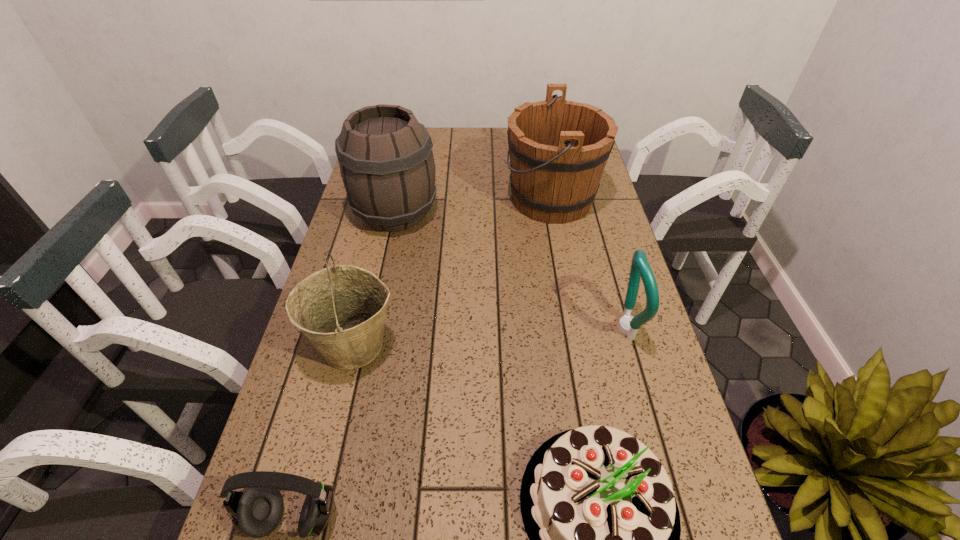
The image size is (960, 540). I want to click on the rightmost wine bucket, so click(x=558, y=149).

Locate an element on the screen. This screenshot has height=540, width=960. the nearest wine bucket is located at coordinates (341, 309).

Locate an element on the screen. the third shortest object is located at coordinates (x=628, y=325).

The image size is (960, 540). In order to click on free space located 0.350m on the side of the rightmost wine bucket with the handle for carrying in this screenshot , I will do `click(396, 199)`.

Where is `blank space located on the side of the rightmost wine bucket with the handle for carrying`? blank space located on the side of the rightmost wine bucket with the handle for carrying is located at coordinates (480, 199).

Where is `free spot located 0.320m on the side of the rightmost wine bucket with the handle for carrying`? The height and width of the screenshot is (540, 960). free spot located 0.320m on the side of the rightmost wine bucket with the handle for carrying is located at coordinates (406, 199).

Find the location of `vacant region located on the back of the nearest wine bucket`. vacant region located on the back of the nearest wine bucket is located at coordinates (382, 229).

You are a GUI agent. You are given a task and a screenshot of the screen. Output one action in this format:
    pyautogui.click(x=<x>, y=<y>)
    Task: Click on the vacant space situated 0.180m at the jaws of the bottle opener
    The image size is (960, 540).
    Given the screenshot: What is the action you would take?
    (538, 328)

At what (x,y) coordinates should I click in order to perform the action: click on vacant region located 0.280m at the jaws of the bottle opener. Please return your answer as a coordinate pair (x, y). The height and width of the screenshot is (540, 960). Looking at the image, I should click on (496, 328).

Identify the location of vacant space situated 0.060m at the jaws of the bottle opener. (587, 328).